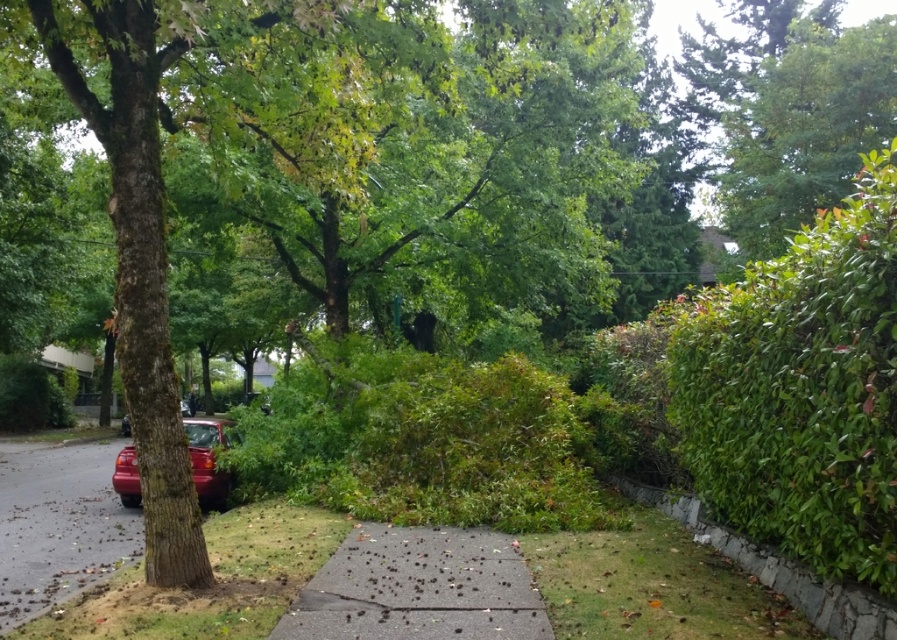
Question: Which point is farther to the camera?

Choices:
 (A) (875, 355)
 (B) (120, 496)
 (C) (745, 557)
 (D) (73, 554)

Answer: (B)

Question: Is green leafy hedge at right further to camera compared to gray concrete sidewalk at center?

Choices:
 (A) no
 (B) yes

Answer: (A)

Question: Which point appears farthest from the camera in this image?

Choices:
 (A) (456, 625)
 (B) (871, 596)
 (C) (828, 323)
 (D) (46, 605)

Answer: (D)

Question: Among these objects, which one is nearest to the camera?

Choices:
 (A) green leafy hedge at right
 (B) gray stone curb at lower right
 (C) gray concrete sidewalk at center
 (D) smooth asphalt road at lower left

Answer: (A)

Question: Does green leafy hedge at right appear on the right side of gray stone curb at lower right?

Choices:
 (A) no
 (B) yes

Answer: (A)

Question: Can you confirm if green leafy hedge at right is thinner than smooth asphalt road at lower left?

Choices:
 (A) yes
 (B) no

Answer: (A)